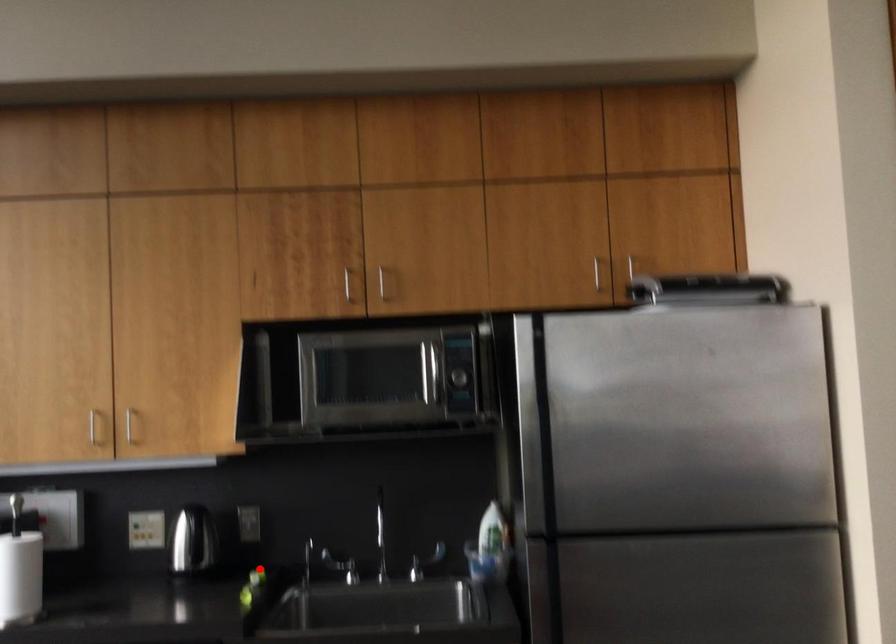
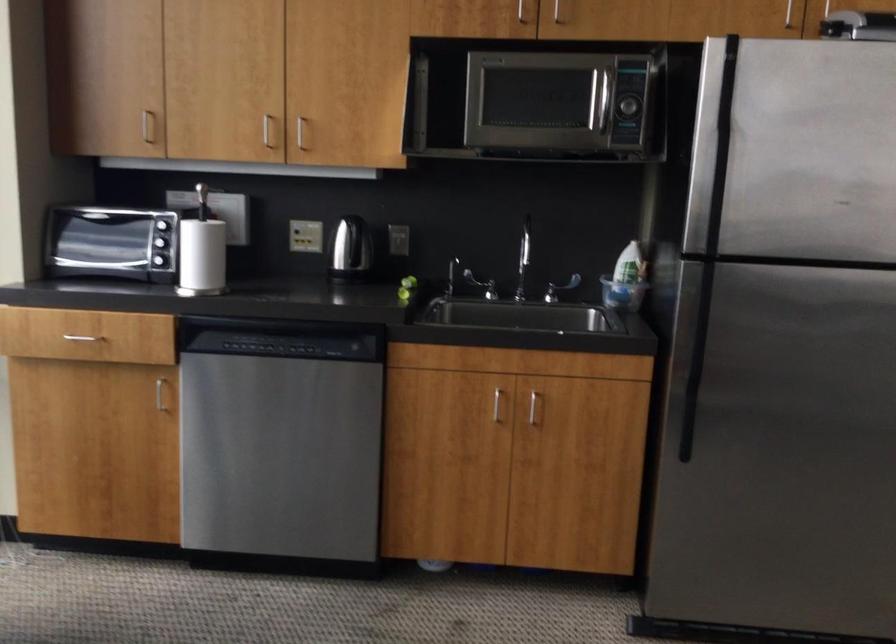
Question: A red point is marked in image1. In image2, is the corresponding 3D point closer to the camera or farther? Reply with the corresponding letter.

Choices:
 (A) The corresponding 3D point is closer.
 (B) The corresponding 3D point is farther.

Answer: (B)